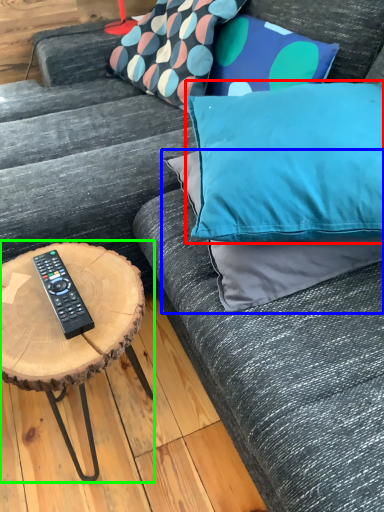
Question: Based on their relative distances, which object is farther from pillow (highlighted by a red box)? Choose from pillow (highlighted by a blue box) and coffee table (highlighted by a green box).

Choices:
 (A) pillow
 (B) coffee table

Answer: (B)